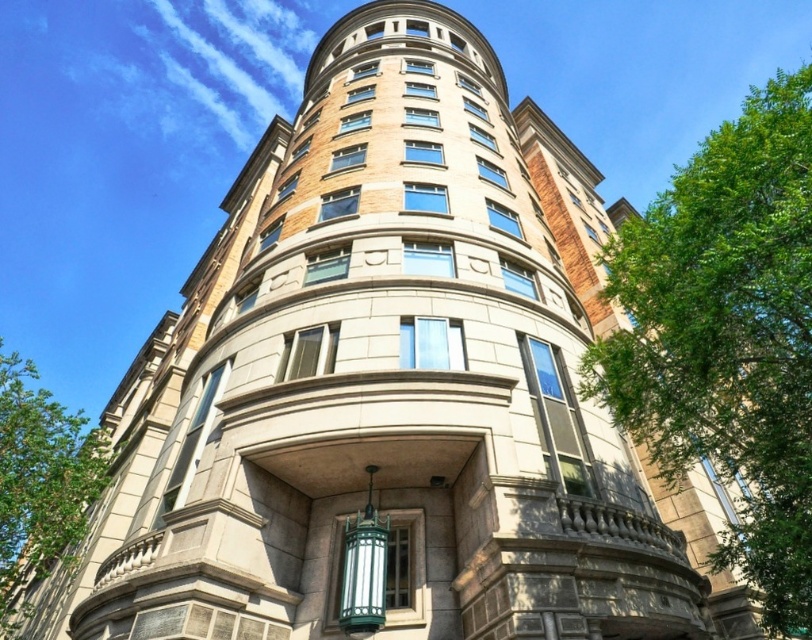
You are a landscape architect planning to add a new tree to the area. The site has limited space, and you need to ensure the new tree won not overshadow the building. Which existing tree, the green leafy tree at right or the green leafy tree at lower left, should you use as a reference for height?

The green leafy tree at right is much taller than the green leafy tree at lower left, so you should use the green leafy tree at right as a reference to ensure the new tree does not overshadow the building.